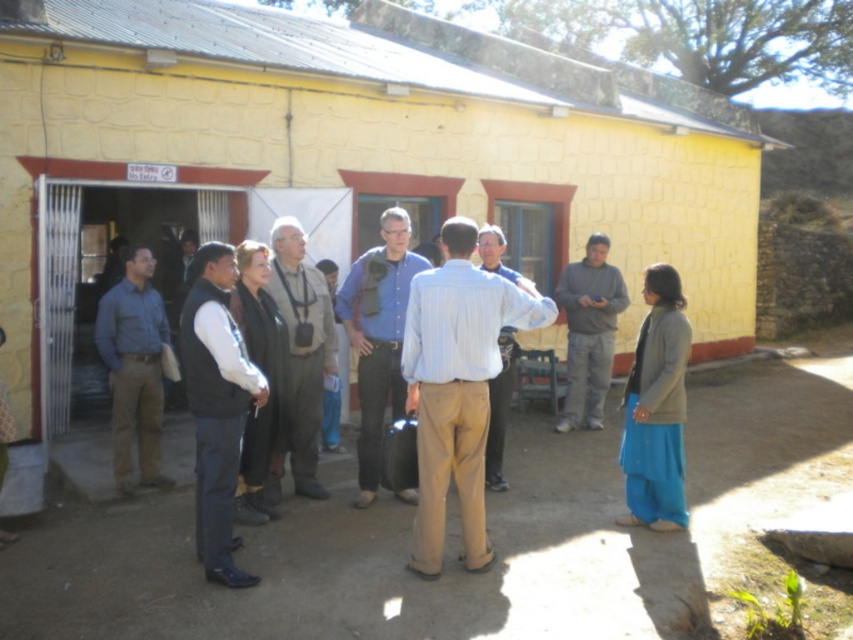
Consider the image. Can you confirm if light blue shirt at center is wider than blue shirt at left?

Yes, light blue shirt at center is wider than blue shirt at left.

How much distance is there between light blue shirt at center and blue shirt at left?

8.27 feet

Is point (460, 294) positioned in front of point (146, 420)?

Yes, it is.

Locate an element on the screen. Image resolution: width=853 pixels, height=640 pixels. light blue shirt at center is located at coordinates (457, 385).

Who is more distant from viewer, (213, 499) or (625, 412)?

The point (625, 412) is behind.

Is black fabric vest at center thinner than blue cotton dress at lower right?

In fact, black fabric vest at center might be wider than blue cotton dress at lower right.

This screenshot has height=640, width=853. What are the coordinates of `black fabric vest at center` in the screenshot? It's located at (216, 404).

Where is `black fabric vest at center`? This screenshot has height=640, width=853. black fabric vest at center is located at coordinates (216, 404).

Is point (669, 284) farther from viewer compared to point (303, 282)?

No.

Does blue cotton dress at lower right have a greater height compared to gray fabric vest at center?

Incorrect, blue cotton dress at lower right's height is not larger of gray fabric vest at center's.

Is point (668, 365) more distant than point (325, 365)?

No, (668, 365) is in front of (325, 365).

The width and height of the screenshot is (853, 640). In order to click on blue cotton dress at lower right in this screenshot , I will do `click(656, 406)`.